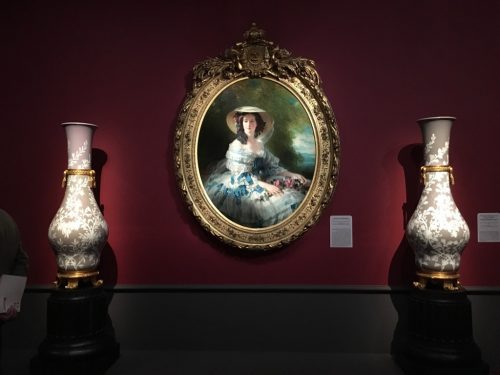
This screenshot has height=375, width=500. I want to click on neck of vase, so click(x=436, y=148), click(x=79, y=157).